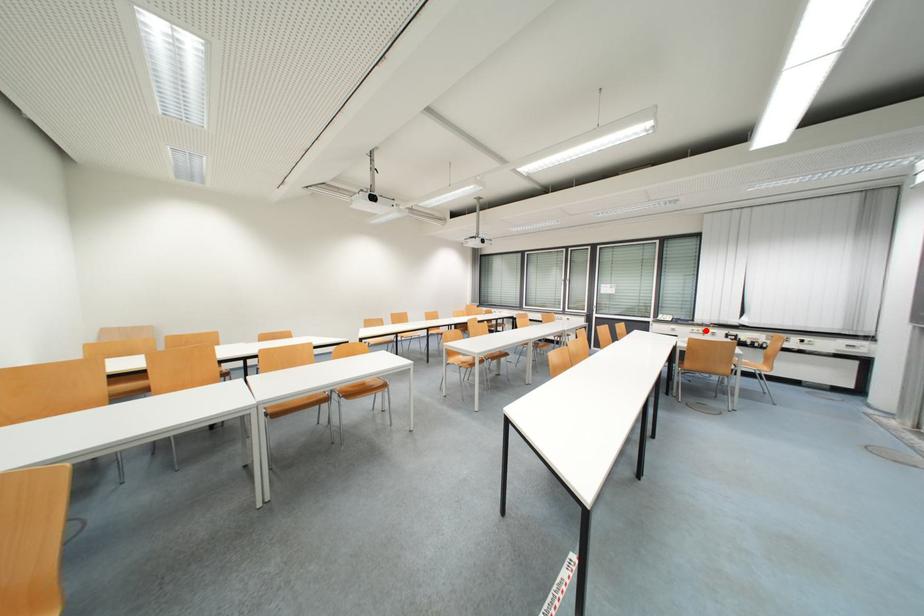
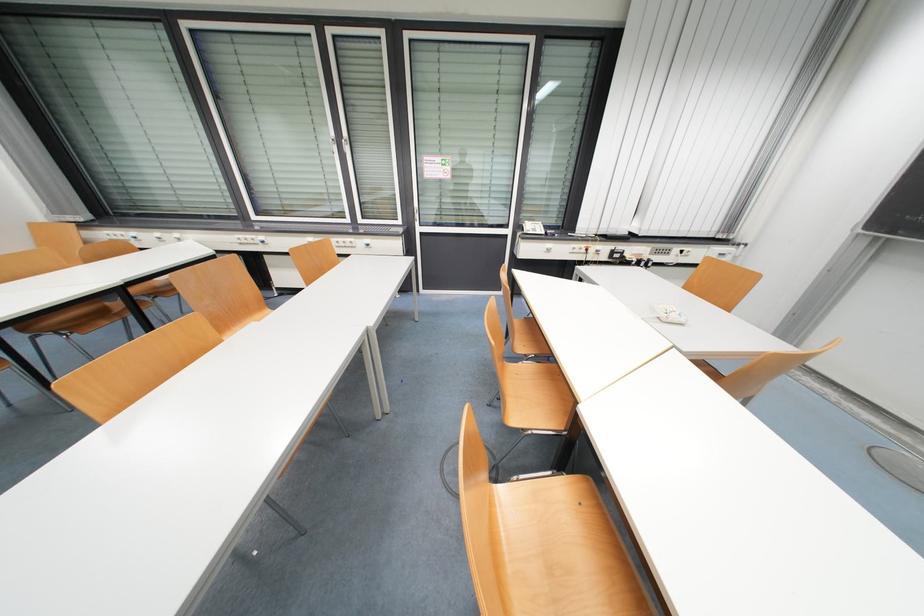
Question: I am providing you with two images of the same scene from different viewpoints. Image1 has a red point marked. In image2, the corresponding 3D location appears at what relative position? Reply with the corresponding letter.

Choices:
 (A) Closer
 (B) Farther

Answer: (A)